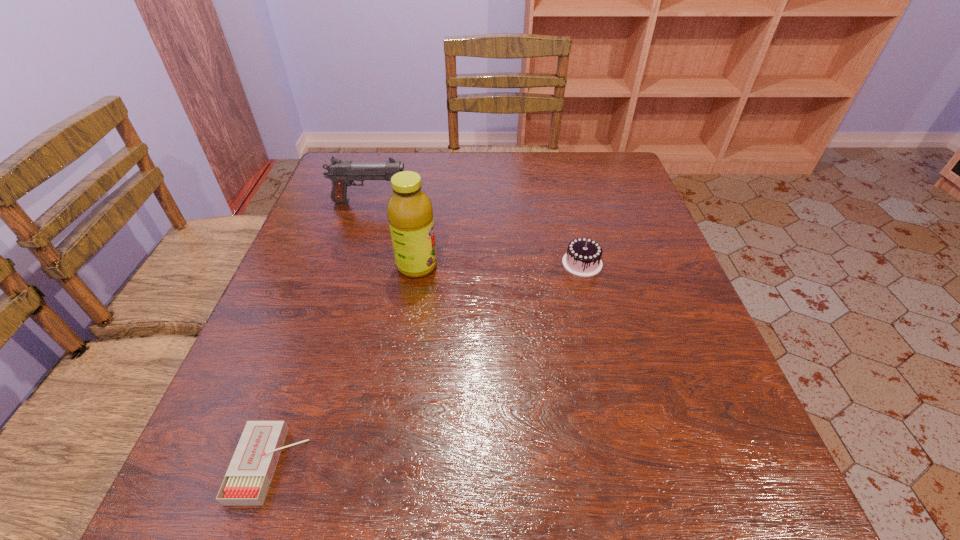
Where is `vacant space in between the second tallest object and the matchbox`? The width and height of the screenshot is (960, 540). vacant space in between the second tallest object and the matchbox is located at coordinates coord(320,333).

Image resolution: width=960 pixels, height=540 pixels. What are the coordinates of `free space between the matchbox and the third object from left to right` in the screenshot? It's located at (344, 366).

Locate an element on the screen. Image resolution: width=960 pixels, height=540 pixels. object that is the second closest one to the gun is located at coordinates (583, 258).

This screenshot has height=540, width=960. Identify the location of object that stands as the second closest to the second tallest object. (583, 258).

Identify the location of free location that satisfies the following two spatial constraints: 1. on the front side of the rightmost object; 2. on the striking surface of the matchbox. (632, 464).

Locate an element on the screen. free space in the image that satisfies the following two spatial constraints: 1. in the direction the gun is aimed; 2. on the left side of the third tallest object is located at coordinates (350, 263).